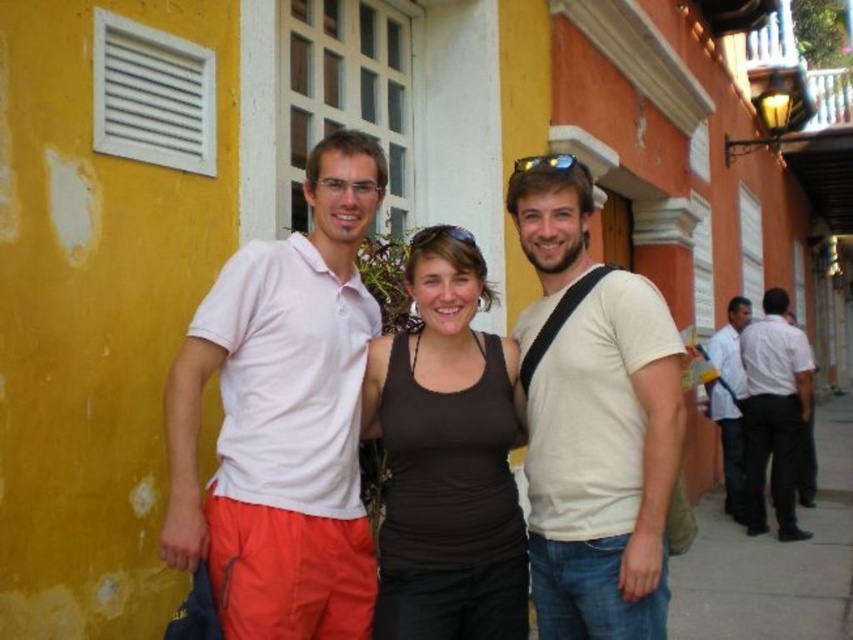
You are standing in the scene and want to move from the point at coordinates point(x=212, y=516) to the point at coordinates point(x=786, y=444). Which direction should you face to walk towards the second point?

You should face towards the upper left direction to walk towards point(x=786, y=444) from point(x=212, y=516).